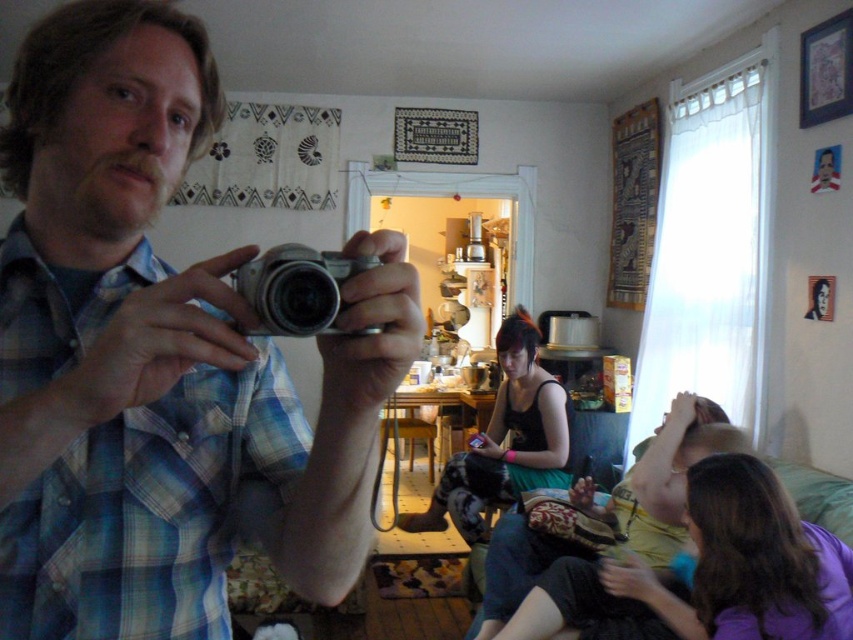
You are a photographer who wants to choose between the two cameras in the scene. The matte silver camera at center and the silver metallic camera at center. Which one is bigger?

The matte silver camera at center is larger in size than the silver metallic camera at center.